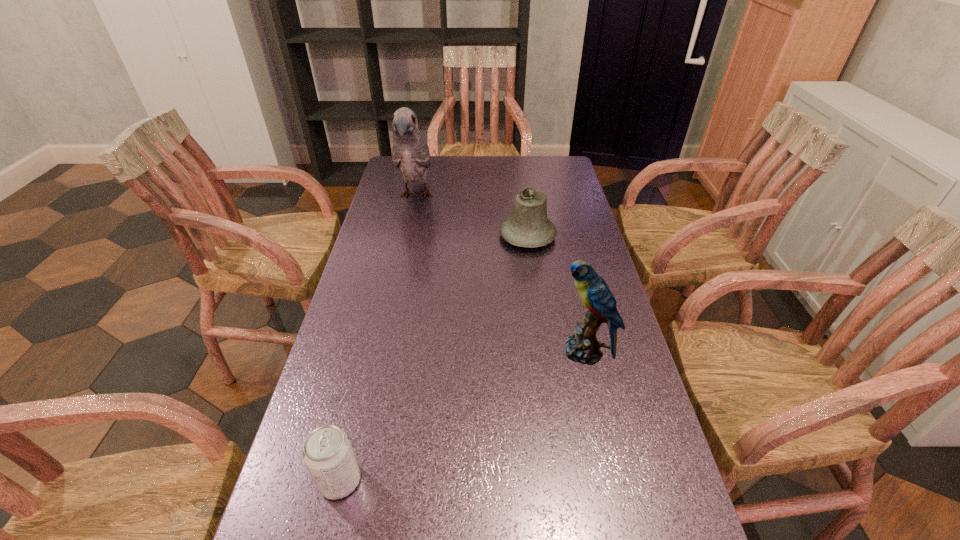
The image size is (960, 540). I want to click on the tallest object, so click(x=411, y=154).

Locate an element on the screen. This screenshot has height=540, width=960. the taller parrot is located at coordinates (411, 154).

At what (x,y) coordinates should I click in order to perform the action: click on the right parrot. Please return your answer as a coordinate pair (x, y). The height and width of the screenshot is (540, 960). Looking at the image, I should click on [582, 346].

The width and height of the screenshot is (960, 540). Find the location of `the second tallest object`. the second tallest object is located at coordinates (582, 346).

This screenshot has width=960, height=540. In order to click on the second shortest object in this screenshot , I will do [528, 226].

Find the location of a particular element. The width and height of the screenshot is (960, 540). bell is located at coordinates (528, 226).

The image size is (960, 540). In order to click on the nearest object in this screenshot , I will do [x=327, y=453].

The image size is (960, 540). Find the location of `the shortest object`. the shortest object is located at coordinates point(327,453).

This screenshot has height=540, width=960. In order to click on free space located 0.250m on the front-facing side of the tallest object in this screenshot , I will do `click(401, 265)`.

Find the location of a particular element. The image size is (960, 540). vacant space located 0.390m on the face of the nearer parrot is located at coordinates (397, 352).